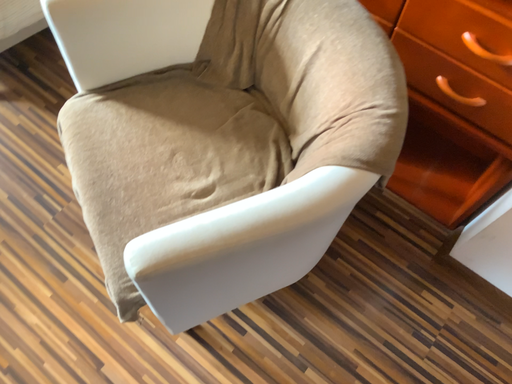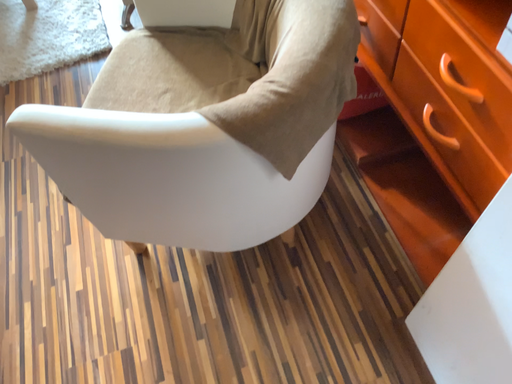
Question: How did the camera likely rotate when shooting the video?

Choices:
 (A) rotated upward
 (B) rotated downward

Answer: (A)